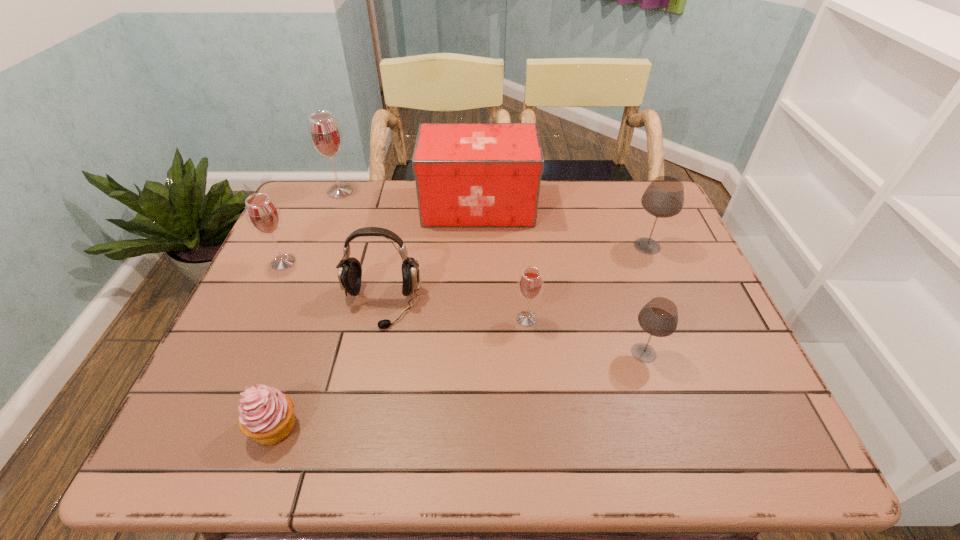
Choose which object is the second nearest neighbor to the rightmost object. Please provide its 2D coordinates. Your answer should be formatted as a tuple, i.e. [(x, y)], where the tuple contains the x and y coordinates of a point satisfying the conditions above.

[(659, 317)]

Locate which wineglass ranks fourth in proximity to the left gray wineglass. Please provide its 2D coordinates. Your answer should be formatted as a tuple, i.e. [(x, y)], where the tuple contains the x and y coordinates of a point satisfying the conditions above.

[(325, 135)]

Locate which wineglass is the second closest to the tallest wineglass. Please provide its 2D coordinates. Your answer should be formatted as a tuple, i.e. [(x, y)], where the tuple contains the x and y coordinates of a point satisfying the conditions above.

[(530, 284)]

Locate an element on the screen. Image resolution: width=960 pixels, height=540 pixels. red wineglass that is the closest one to the headset is located at coordinates (263, 215).

Find the location of `the closest red wineglass to the nearest object`. the closest red wineglass to the nearest object is located at coordinates (263, 215).

Image resolution: width=960 pixels, height=540 pixels. Find the location of `vacant space that satisfies the following two spatial constraints: 1. on the front side of the tallest wineglass; 2. on the right side of the cupcake`. vacant space that satisfies the following two spatial constraints: 1. on the front side of the tallest wineglass; 2. on the right side of the cupcake is located at coordinates (248, 427).

The image size is (960, 540). I want to click on free region that satisfies the following two spatial constraints: 1. on the handle side of the first-aid kit; 2. on the right side of the second nearest object, so click(x=478, y=353).